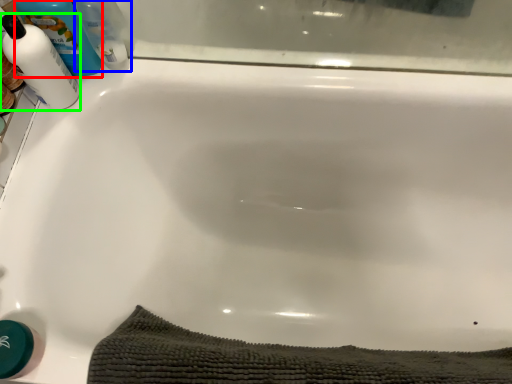
Question: Estimate the real-world distances between objects in this image. Which object is closer to cleaning product (highlighted by a red box), cleaning product (highlighted by a blue box) or cleaning product (highlighted by a green box)?

Choices:
 (A) cleaning product
 (B) cleaning product

Answer: (B)